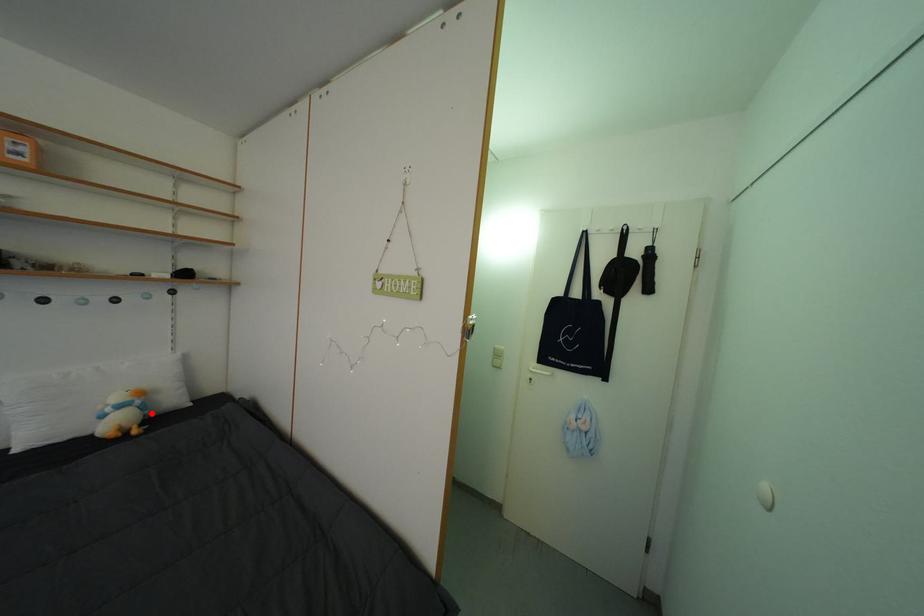
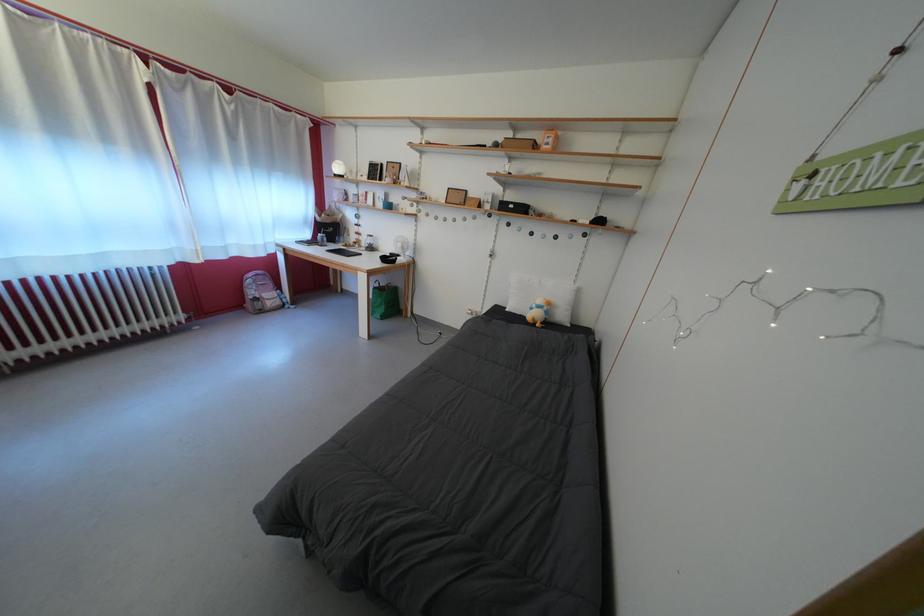
Find the pixel in the second image that matches the highlighted location in the first image.

(554, 318)